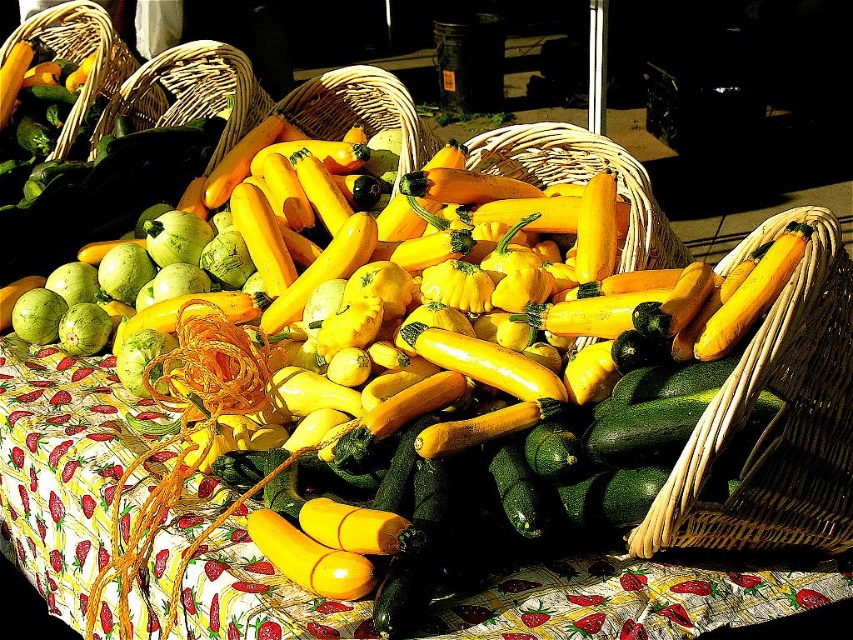
You are arranging vegetables on a table and need to move the woven wicker basket at right and the woven straw basket at upper left. Which basket should you move first to avoid blocking the other?

You should move the woven straw basket at upper left first because it is positioned above the woven wicker basket at right, so moving it first would prevent blocking access to the lower basket.